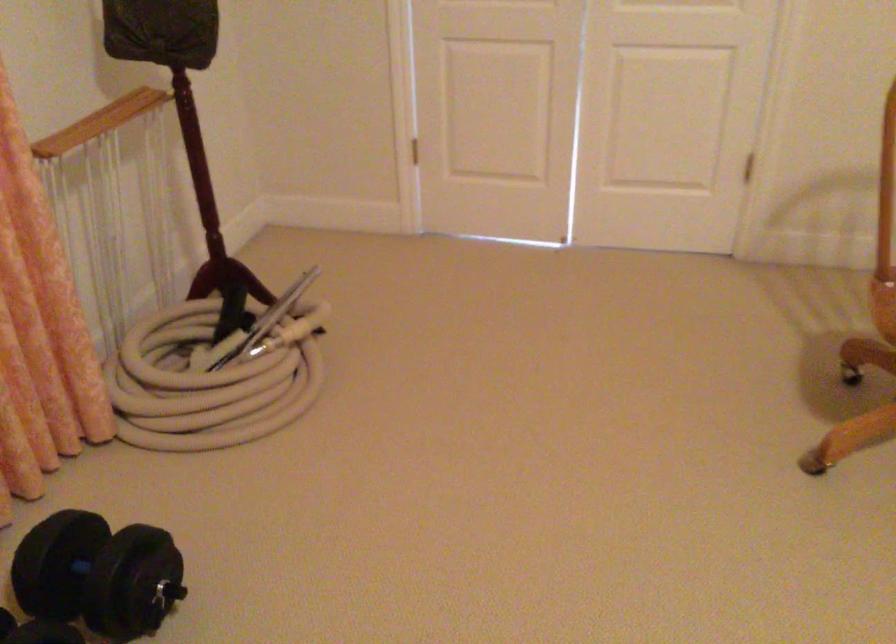
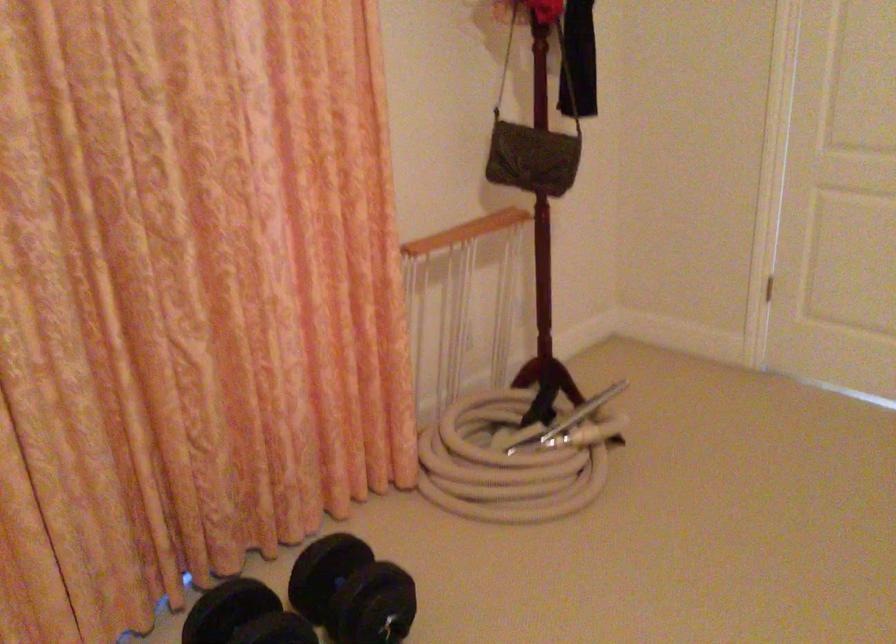
Where in the second image is the point corresponding to point 211,389 from the first image?

(503, 466)